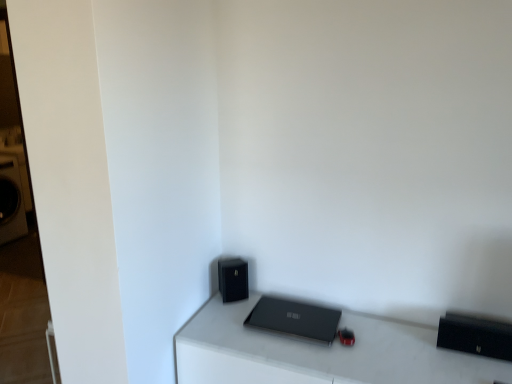
Locate an element on the screen. The image size is (512, 384). free space on the front side of black matte speaker at lower center is located at coordinates (223, 322).